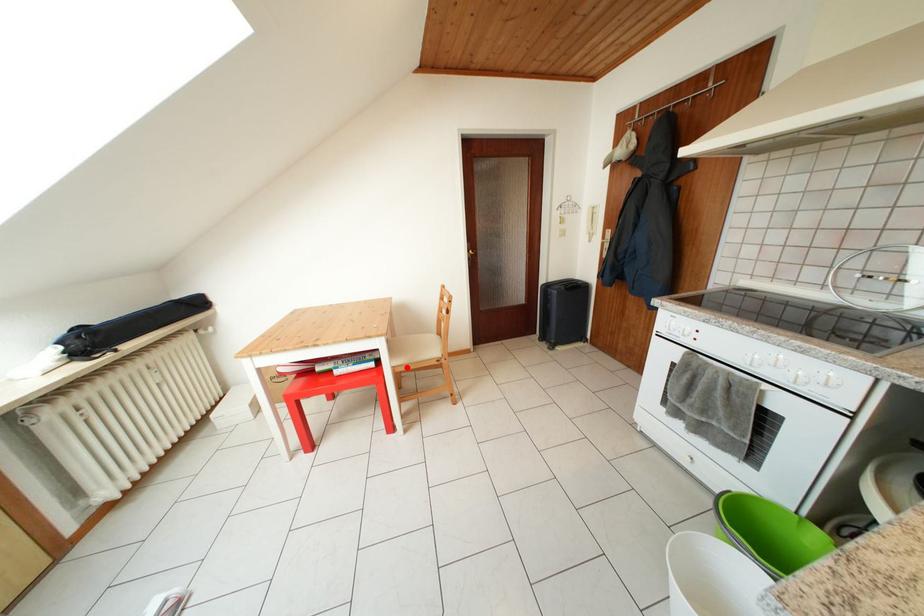
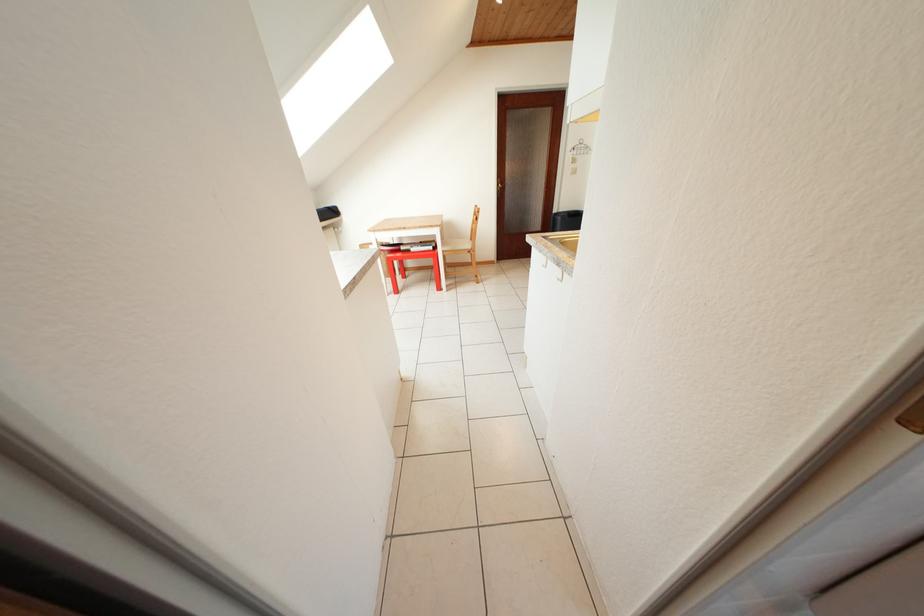
The point at the highlighted location is marked in the first image. Where is the corresponding point in the second image?

(454, 254)